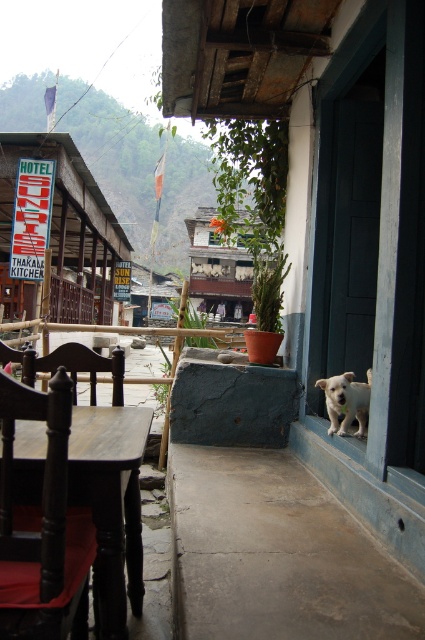
Does smooth concrete porch at lower center come in front of transparent glass window at center?

That is True.

Can you confirm if smooth concrete porch at lower center is positioned below transparent glass window at center?

Yes.

Is point (53, 344) positioned after point (263, 243)?

Yes, point (53, 344) is behind point (263, 243).

This screenshot has width=425, height=640. What are the coordinates of `smooth concrete porch at lower center` in the screenshot? It's located at (280, 556).

Looking at this image, does smooth concrete porch at lower center have a larger size compared to white fur dog at lower right?

Correct, smooth concrete porch at lower center is larger in size than white fur dog at lower right.

Between point (252, 470) and point (367, 394), which one is positioned behind?

The point (252, 470) is more distant.

Locate an element on the screen. smooth concrete porch at lower center is located at coordinates (280, 556).

Is white fur dog at lower right further to camera compared to transparent glass window at center?

No, it is not.

Who is more distant from viewer, (351, 372) or (218, 237)?

The point (218, 237) is more distant.

Find the location of `white fur dog at lower right`. white fur dog at lower right is located at coordinates (345, 401).